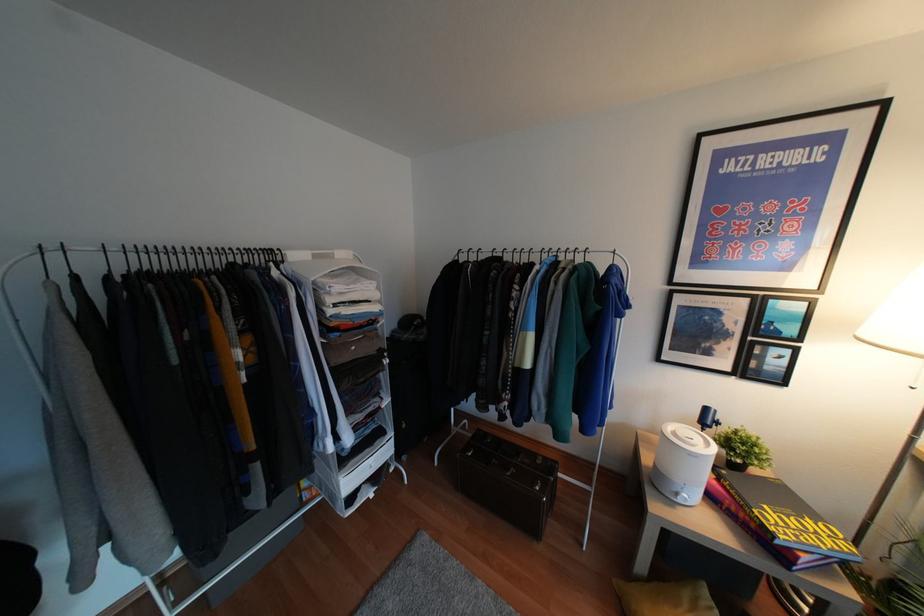
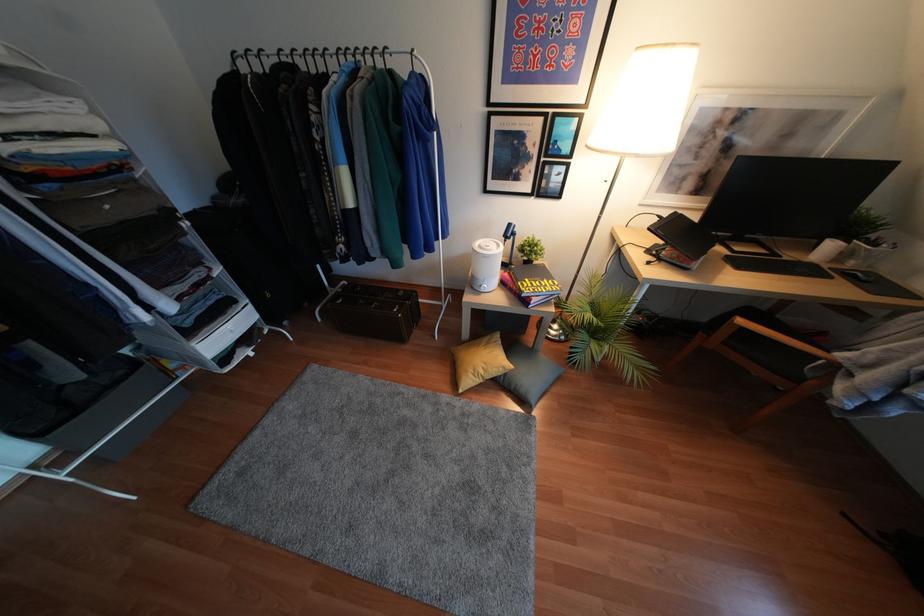
Based on the continuous images, in which direction is the camera rotating?

The rotation direction of the camera is right-down.